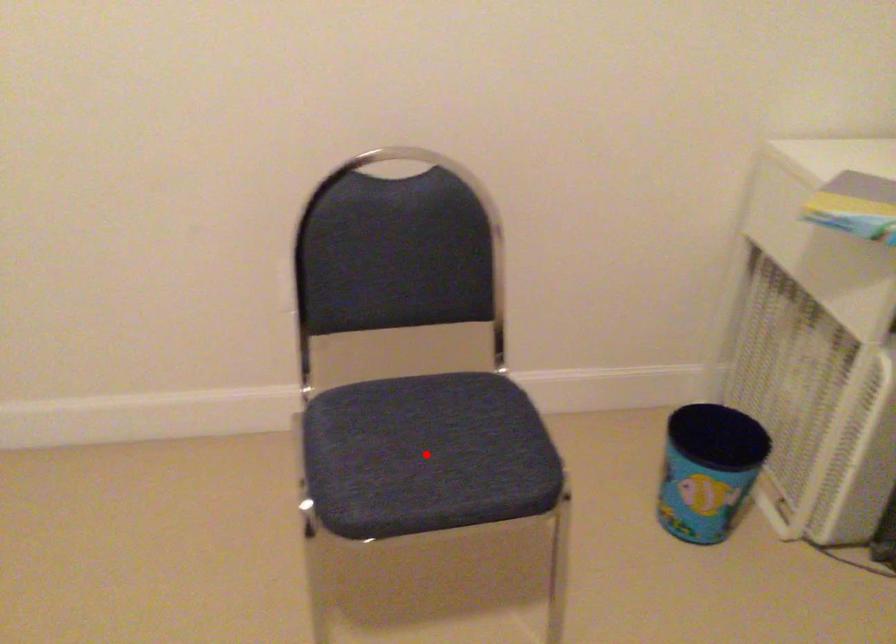
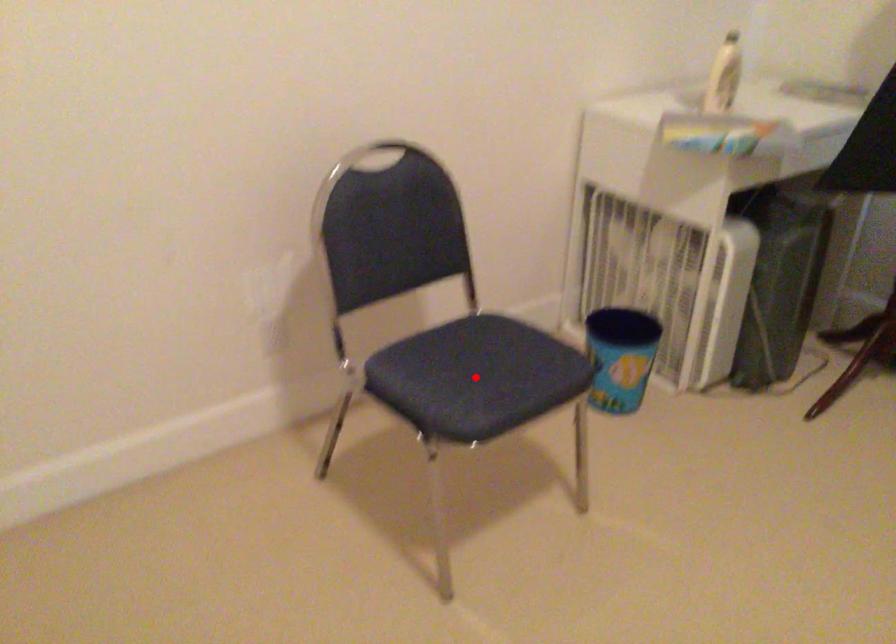
I am providing you with two images of the same scene from different viewpoints. A red point is marked on the first image and another point is marked on the second image. Are the points marked in image1 and image2 representing the same 3D position?

Yes